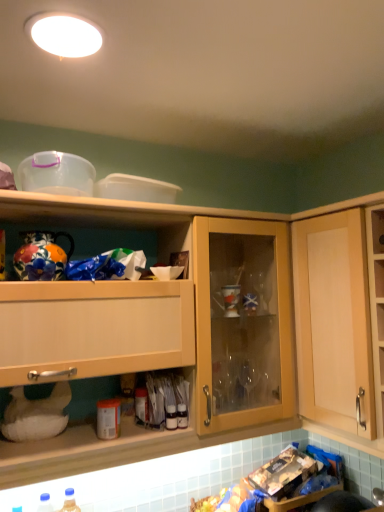
Question: Can you confirm if matte plastic bottle at center, which is counted as the first bottle, starting from the top, is bigger than wooden cabinet at upper center, arranged as the first cabinetry when viewed from the left?

Choices:
 (A) no
 (B) yes

Answer: (A)

Question: Can you confirm if matte plastic bottle at center, acting as the 2th bottle starting from the left, is shorter than wooden cabinet at upper center, which appears as the second cabinetry when viewed from the right?

Choices:
 (A) yes
 (B) no

Answer: (A)

Question: Is matte plastic bottle at center, which is the 2th bottle from right to left, in contact with wooden cabinet at upper center, which appears as the second cabinetry when viewed from the right?

Choices:
 (A) yes
 (B) no

Answer: (B)

Question: Is matte plastic bottle at center, which is counted as the first bottle, starting from the top, aimed at wooden cabinet at upper center, arranged as the first cabinetry when viewed from the left?

Choices:
 (A) no
 (B) yes

Answer: (B)

Question: Is matte plastic bottle at center, which is the 2th bottle from right to left, positioned with its back to wooden cabinet at upper center, which appears as the second cabinetry when viewed from the right?

Choices:
 (A) yes
 (B) no

Answer: (A)

Question: Is wooden cabinet at upper center, which appears as the second cabinetry when viewed from the right, surrounded by matte plastic bottle at center, which is counted as the first bottle, starting from the top?

Choices:
 (A) yes
 (B) no

Answer: (B)

Question: Can you confirm if wooden cabinet at upper center, which appears as the second cabinetry when viewed from the right, is bigger than white glossy light fixture at upper center?

Choices:
 (A) no
 (B) yes

Answer: (B)

Question: Does wooden cabinet at upper center, which appears as the second cabinetry when viewed from the right, have a lesser width compared to white glossy light fixture at upper center?

Choices:
 (A) no
 (B) yes

Answer: (A)

Question: Is wooden cabinet at upper center, arranged as the first cabinetry when viewed from the left, facing towards white glossy light fixture at upper center?

Choices:
 (A) yes
 (B) no

Answer: (B)

Question: Does wooden cabinet at upper center, which appears as the second cabinetry when viewed from the right, have a smaller size compared to white glossy light fixture at upper center?

Choices:
 (A) no
 (B) yes

Answer: (A)

Question: Does wooden cabinet at upper center, arranged as the first cabinetry when viewed from the left, have a greater height compared to white glossy light fixture at upper center?

Choices:
 (A) yes
 (B) no

Answer: (A)

Question: Can you confirm if wooden cabinet at upper center, which appears as the second cabinetry when viewed from the right, is taller than matte plastic bottle at center, acting as the 2th bottle starting from the left?

Choices:
 (A) no
 (B) yes

Answer: (B)